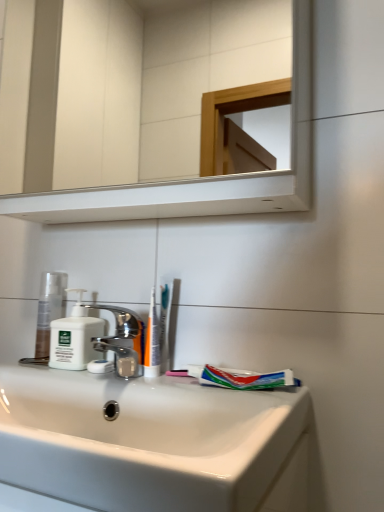
The image size is (384, 512). Identify the location of matte white lotion at left. (49, 309).

What do you see at coordinates (125, 87) in the screenshot? I see `white glossy mirror at upper center` at bounding box center [125, 87].

The height and width of the screenshot is (512, 384). Identify the location of polished chrome faucet at center. (x=123, y=341).

Locate an element on the screen. This screenshot has width=384, height=512. matte white lotion at left is located at coordinates (49, 309).

Considering the relative positions of white matte soap dispenser at left and white glossy sink at lower center in the image provided, is white matte soap dispenser at left to the right of white glossy sink at lower center from the viewer's perspective?

No.

Which of these two, white matte soap dispenser at left or white glossy sink at lower center, stands shorter?

Standing shorter between the two is white matte soap dispenser at left.

Is white matte soap dispenser at left oriented towards white glossy sink at lower center?

No.

Is white glossy sink at lower center inside white matte soap dispenser at left?

No, white glossy sink at lower center is not inside white matte soap dispenser at left.

Considering the positions of points (45, 333) and (150, 357), is point (45, 333) closer to camera compared to point (150, 357)?

No, it is not.

Where is `toiletry behind the white plastic toothbrush at center`? The width and height of the screenshot is (384, 512). toiletry behind the white plastic toothbrush at center is located at coordinates (49, 309).

Identify the location of sink below the white glossy mirror at upper center (from a real-world perspective). The width and height of the screenshot is (384, 512). (152, 442).

Which of these two, white glossy mirror at upper center or white glossy sink at lower center, is bigger?

With larger size is white glossy mirror at upper center.

Which of these two, white glossy mirror at upper center or white glossy sink at lower center, is wider?

With larger width is white glossy sink at lower center.

Are white glossy mirror at upper center and white glossy sink at lower center far apart?

That's right, there is a large distance between white glossy mirror at upper center and white glossy sink at lower center.

Considering the relative sizes of polished chrome faucet at center and matte white lotion at left in the image provided, is polished chrome faucet at center bigger than matte white lotion at left?

Yes, polished chrome faucet at center is bigger than matte white lotion at left.

Is polished chrome faucet at center in front of matte white lotion at left?

Yes, it is.

Is matte white lotion at left at the back of polished chrome faucet at center?

That's not correct — polished chrome faucet at center is not looking away from matte white lotion at left.

Can you confirm if polished chrome faucet at center is positioned to the right of matte white lotion at left?

Yes.

Is polished chrome faucet at center far away from white matte soap dispenser at left?

No, polished chrome faucet at center is not far from white matte soap dispenser at left.

What's the angular difference between polished chrome faucet at center and white matte soap dispenser at left's facing directions?

The angular difference between polished chrome faucet at center and white matte soap dispenser at left is 5.44 degrees.

Is polished chrome faucet at center turned away from white matte soap dispenser at left?

No.

Does polished chrome faucet at center have a smaller size compared to white matte soap dispenser at left?

No.

Does polished chrome faucet at center contain white glossy sink at lower center?

No.

Is polished chrome faucet at center far from white glossy sink at lower center?

Actually, polished chrome faucet at center and white glossy sink at lower center are a little close together.

From the image's perspective, relative to white glossy sink at lower center, is polished chrome faucet at center above or below?

polished chrome faucet at center is situated higher than white glossy sink at lower center in the image.

Between matte white lotion at left and white matte soap dispenser at left, which one has more height?

matte white lotion at left is taller.

Is matte white lotion at left located outside white matte soap dispenser at left?

Absolutely, matte white lotion at left is external to white matte soap dispenser at left.

Which is further, (51,303) or (92,327)?

The point (51,303) is farther.

In order to click on sink below the white matte soap dispenser at left (from the image's perspective) in this screenshot , I will do `click(152, 442)`.

I want to click on toothbrush located in front of the matte white lotion at left, so click(152, 342).

When comparing their distances from white glossy mirror at upper center, does white matte soap dispenser at left or white plastic toothbrush at center seem closer?

white matte soap dispenser at left.

Considering their positions, is matte white lotion at left positioned further to white glossy sink at lower center than white plastic toothbrush at center?

Based on the image, matte white lotion at left appears to be further to white glossy sink at lower center.

From the image, which object appears to be nearer to white matte soap dispenser at left, matte white lotion at left or multicolored plastic toothpaste at lower center?

The object closer to white matte soap dispenser at left is matte white lotion at left.

Based on their spatial positions, is matte white lotion at left or white plastic toothbrush at center further from white matte soap dispenser at left?

The object further to white matte soap dispenser at left is white plastic toothbrush at center.

Which object lies further to the anchor point white glossy sink at lower center, matte white lotion at left or white matte soap dispenser at left?

matte white lotion at left lies further to white glossy sink at lower center than the other object.

Considering their positions, is white glossy sink at lower center positioned closer to white glossy mirror at upper center than white matte soap dispenser at left?

Based on the image, white glossy sink at lower center appears to be nearer to white glossy mirror at upper center.

Consider the image. Based on their spatial positions, is white matte soap dispenser at left or matte white lotion at left closer to white glossy mirror at upper center?

matte white lotion at left is positioned closer to the anchor white glossy mirror at upper center.

Looking at the image, which one is located closer to white matte soap dispenser at left, white plastic toothbrush at center or polished chrome faucet at center?

Among the two, polished chrome faucet at center is located nearer to white matte soap dispenser at left.

What are the coordinates of `toothbrush between matte white lotion at left and multicolored plastic toothpaste at lower center in the horizontal direction` in the screenshot? It's located at (152, 342).

Where is `toothbrush between white glossy mirror at upper center and polished chrome faucet at center from top to bottom`? toothbrush between white glossy mirror at upper center and polished chrome faucet at center from top to bottom is located at coordinates (152, 342).

This screenshot has height=512, width=384. Find the location of `toothbrush between white glossy mirror at upper center and white matte soap dispenser at left in the vertical direction`. toothbrush between white glossy mirror at upper center and white matte soap dispenser at left in the vertical direction is located at coordinates (152, 342).

Find the location of a particular element. tap between matte white lotion at left and multicolored plastic toothpaste at lower center from left to right is located at coordinates (123, 341).